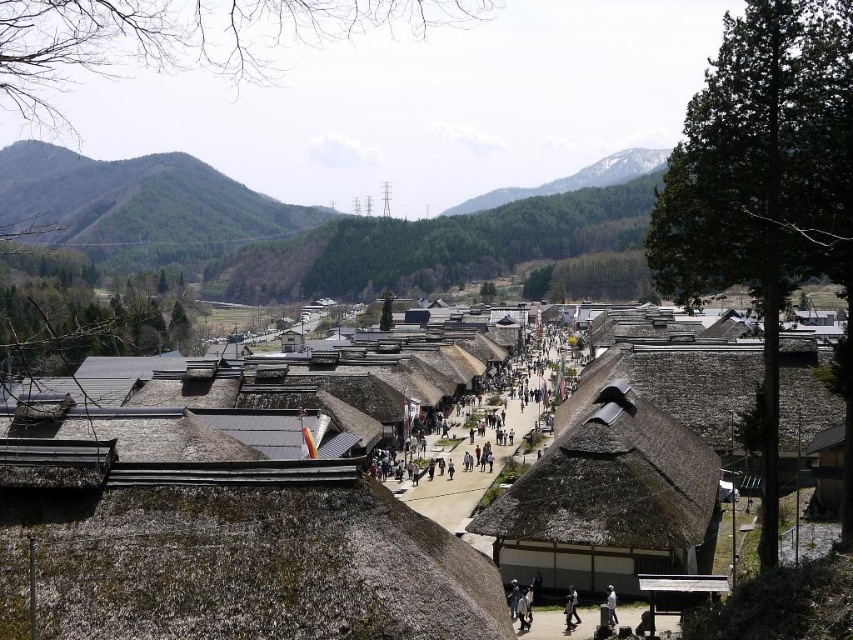
Based on the scene description, which object is located below the other between the green leafy hillside at upper left and the green forested mountain at upper center?

The green leafy hillside at upper left is positioned under the green forested mountain at upper center.

You are standing at the entrance of the village and looking towards the mountains. Which of the two, the green leafy hillside at upper left or the green forested mountain at upper center, would block your view of the sky if you were to stand directly in front of them?

The green leafy hillside at upper left is in front of the green forested mountain at upper center, so it would block your view of the sky first.